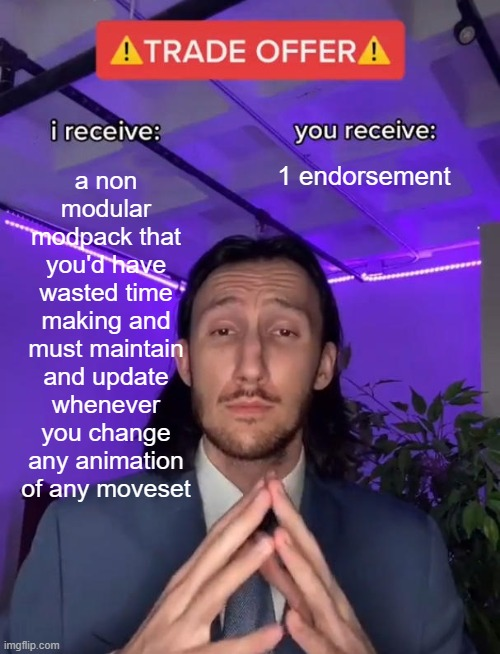
At what (x,y) coordinates should I click in order to perform the action: click on string lights along top of the walls. Please return your answer as a coordinate pair (x, y). Looking at the image, I should click on (430, 269), (335, 282), (83, 252).